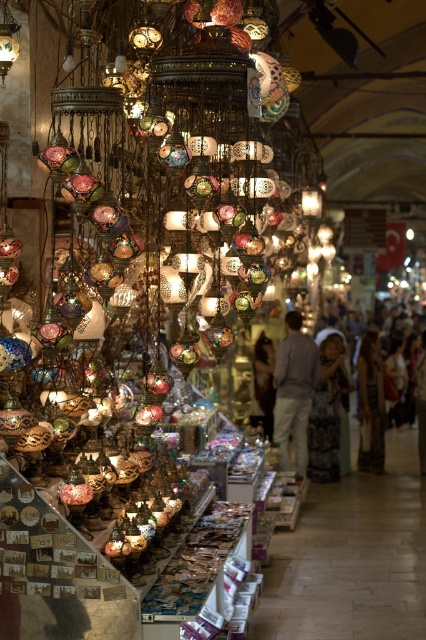
Question: Which of the following is the closest to the observer?

Choices:
 (A) silky white dress at center
 (B) matte brown leather jacket at center
 (C) patterned fabric dress at center
 (D) light brown cotton shirt at center

Answer: (D)

Question: Does silky white dress at center have a greater width compared to matte brown leather jacket at center?

Choices:
 (A) no
 (B) yes

Answer: (B)

Question: Is light brown cotton shirt at center positioned at the back of matte brown leather jacket at center?

Choices:
 (A) yes
 (B) no

Answer: (B)

Question: Which point is closer to the camera?

Choices:
 (A) (288, 419)
 (B) (374, 403)
 (C) (319, 403)
 (D) (253, 392)

Answer: (A)

Question: Can you confirm if silky white dress at center is thinner than matte brown leather jacket at center?

Choices:
 (A) yes
 (B) no

Answer: (B)

Question: Which of these objects is positioned closest to the light brown cotton shirt at center?

Choices:
 (A) silky white dress at center
 (B) matte brown leather jacket at center

Answer: (B)